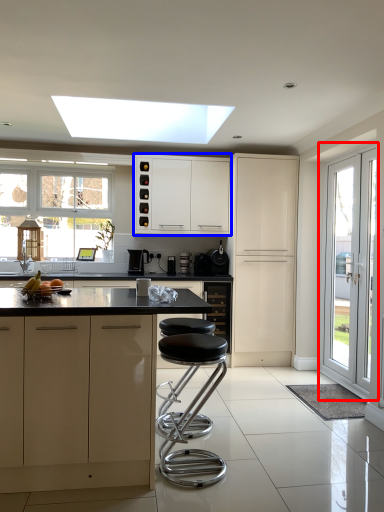
Question: Which point is further to the camera, door (highlighted by a red box) or cabinetry (highlighted by a blue box)?

Choices:
 (A) door
 (B) cabinetry

Answer: (B)